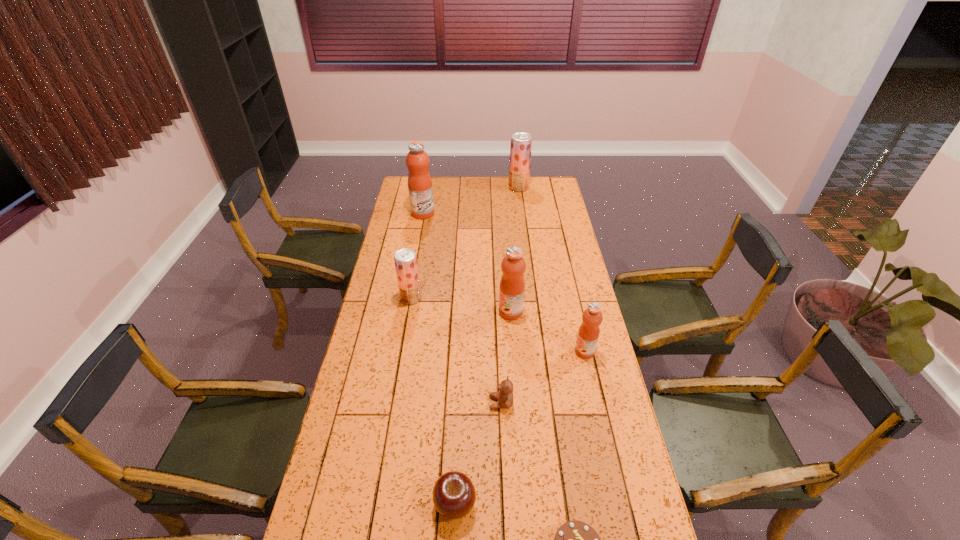
Where is `free space between the third nearest object and the rightmost object`? free space between the third nearest object and the rightmost object is located at coordinates (542, 377).

Select which object appears as the seventh closest to the third nearest object. Please provide its 2D coordinates. Your answer should be formatted as a tuple, i.e. [(x, y)], where the tuple contains the x and y coordinates of a point satisfying the conditions above.

[(521, 143)]

Find the location of `object that is the sixth closest to the second orange fruit juice from right to left`. object that is the sixth closest to the second orange fruit juice from right to left is located at coordinates coord(574,539).

At what (x,y) coordinates should I click in order to perform the action: click on fruit juice that is the closest to the tallest fruit juice. Please return your answer as a coordinate pair (x, y). The height and width of the screenshot is (540, 960). Looking at the image, I should click on (521, 143).

Select which fruit juice appears as the closest to the brown teddy bear. Please provide its 2D coordinates. Your answer should be formatted as a tuple, i.e. [(x, y)], where the tuple contains the x and y coordinates of a point satisfying the conditions above.

[(588, 333)]

Find the location of a particular element. The width and height of the screenshot is (960, 540). orange fruit juice object that ranks as the third closest to the farther strawberry fruit juice is located at coordinates (x=588, y=333).

Where is `the third closest orange fruit juice relative to the smaller strawberry fruit juice`? the third closest orange fruit juice relative to the smaller strawberry fruit juice is located at coordinates (588, 333).

At what (x,y) coordinates should I click in order to perform the action: click on vacant space that satisfies the following two spatial constraints: 1. on the front side of the right strawberry fruit juice; 2. on the front label of the leftmost orange fruit juice. Please return your answer as a coordinate pair (x, y). This screenshot has height=540, width=960. Looking at the image, I should click on (522, 213).